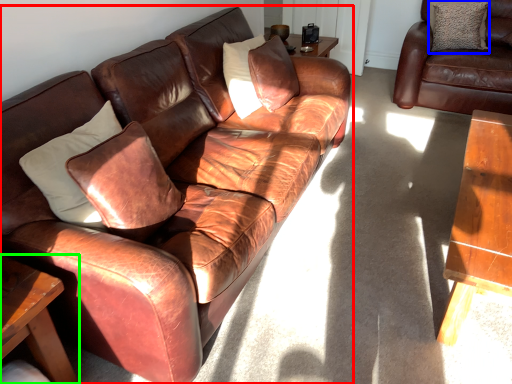
Question: Which object is the closest to the studio couch (highlighted by a red box)? Choose among these: pillow (highlighted by a blue box) or table (highlighted by a green box).

Choices:
 (A) pillow
 (B) table

Answer: (B)